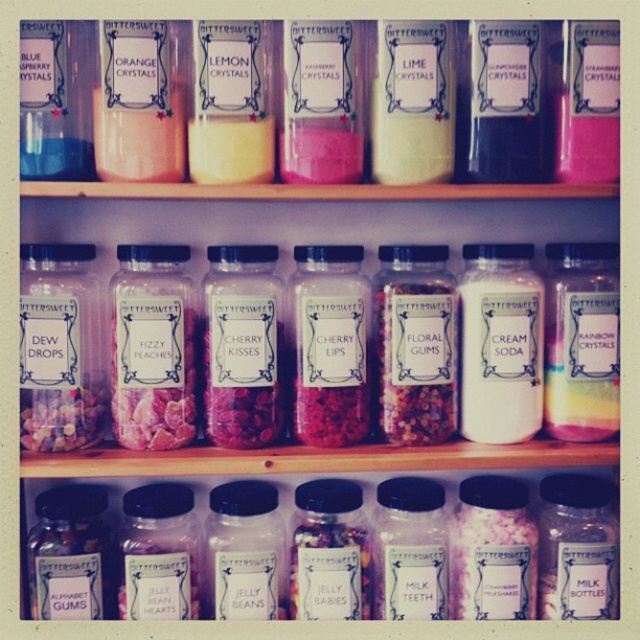
You are a customer at a candy store looking at the jars on the shelf. You want to grab the pink crystal at center but accidentally knock over the white matte lime crystals at center. Which jar will hit the floor first?

The pink crystal at center will hit the floor first because it is closer to the viewer than the white matte lime crystals at center.

You are a candy maker preparing a new flavor. You have two jars in front of you on the shelf. One contains the pink crystal at center and the other has the white matte lime crystals at center. Which jar has a wider opening to accommodate larger crystals?

The white matte lime crystals at center has a wider opening since it is thicker than the pink crystal at center.

You are a store employee who needs to place a new 8 inch wide box between the matte glass jar of cherry kisses at center and the white matte lime crystals at center. Can you fit the box between them?

The distance between the matte glass jar of cherry kisses at center and the white matte lime crystals at center is 9.06 inches, so yes, the 8 inch wide box can fit between them since it is narrower than the available space.